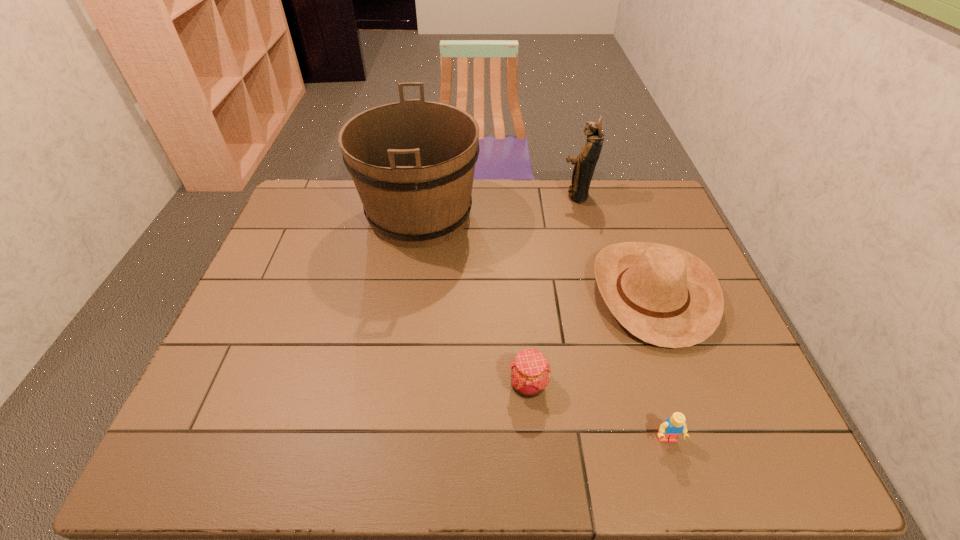
Image resolution: width=960 pixels, height=540 pixels. Find the location of `blank region between the bucket and the figurine`. blank region between the bucket and the figurine is located at coordinates (498, 206).

In order to click on free spot between the leftmost object and the nearest object in this screenshot , I will do `click(543, 327)`.

Identify which object is the fourth closest to the tallest object. Please provide its 2D coordinates. Your answer should be formatted as a tuple, i.e. [(x, y)], where the tuple contains the x and y coordinates of a point satisfying the conditions above.

[(671, 428)]

The width and height of the screenshot is (960, 540). Find the location of `the third closest object to the tallest object`. the third closest object to the tallest object is located at coordinates (529, 371).

At what (x,y) coordinates should I click in order to perform the action: click on free space in the image that satisfies the following two spatial constraints: 1. on the front side of the fourth object from right to left; 2. on the right side of the bucket. Please return your answer as a coordinate pair (x, y). Looking at the image, I should click on (394, 385).